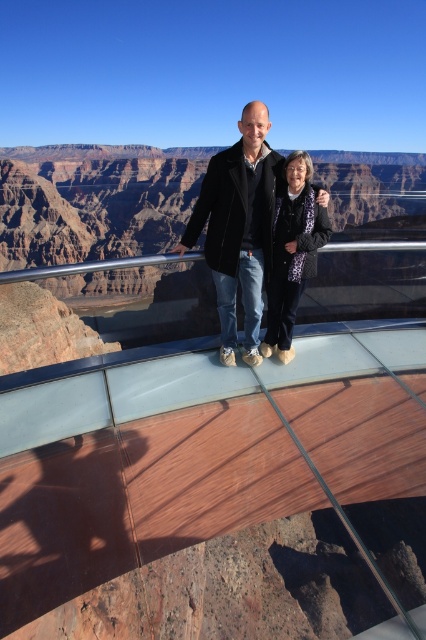
Can you confirm if matte black coat at center is taller than patterned fabric coat at center?

No, matte black coat at center is not taller than patterned fabric coat at center.

Does point (195, 241) lie behind point (276, 252)?

Yes, it is behind point (276, 252).

In order to click on matte black coat at center in this screenshot , I will do `click(238, 227)`.

The height and width of the screenshot is (640, 426). I want to click on matte black coat at center, so click(x=238, y=227).